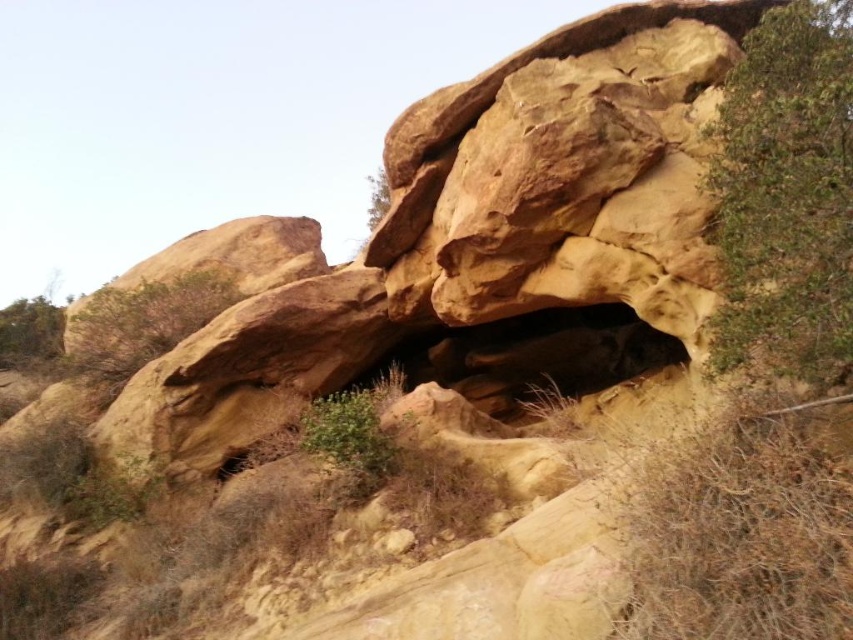
Question: Does green leafy tree at left appear under green leafy tree at upper center?

Choices:
 (A) no
 (B) yes

Answer: (B)

Question: Which point appears closest to the camera in this image?

Choices:
 (A) (45, 349)
 (B) (788, 353)
 (C) (368, 221)

Answer: (B)

Question: Based on their relative distances, which object is farther from the green leafy tree at upper center?

Choices:
 (A) green leafy shrub at upper right
 (B) green leafy tree at left

Answer: (B)

Question: Is green leafy tree at left smaller than green leafy tree at upper center?

Choices:
 (A) yes
 (B) no

Answer: (B)

Question: Does green leafy shrub at upper right have a greater width compared to green leafy tree at upper center?

Choices:
 (A) no
 (B) yes

Answer: (A)

Question: Which of the following is the closest to the observer?

Choices:
 (A) (35, 324)
 (B) (741, 77)
 (C) (374, 198)

Answer: (B)